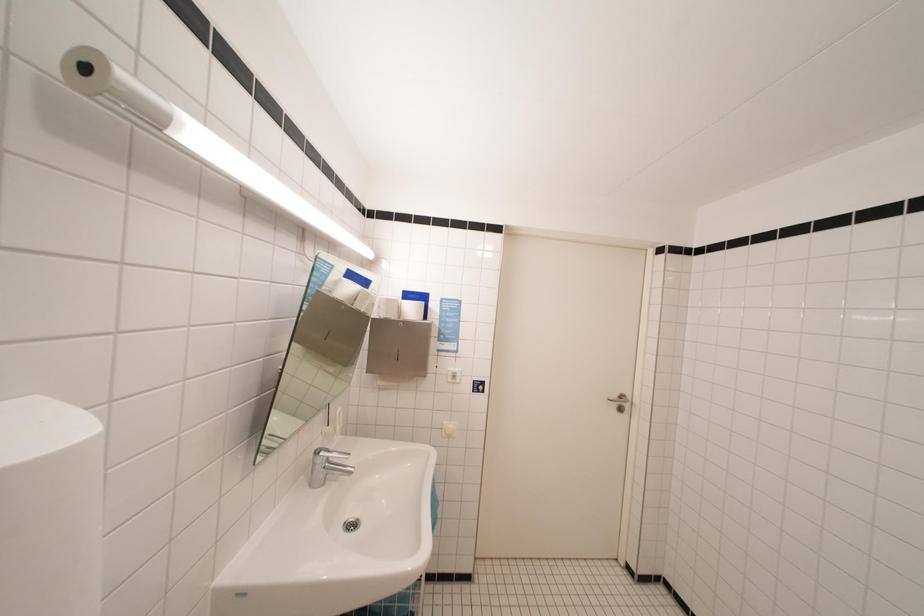
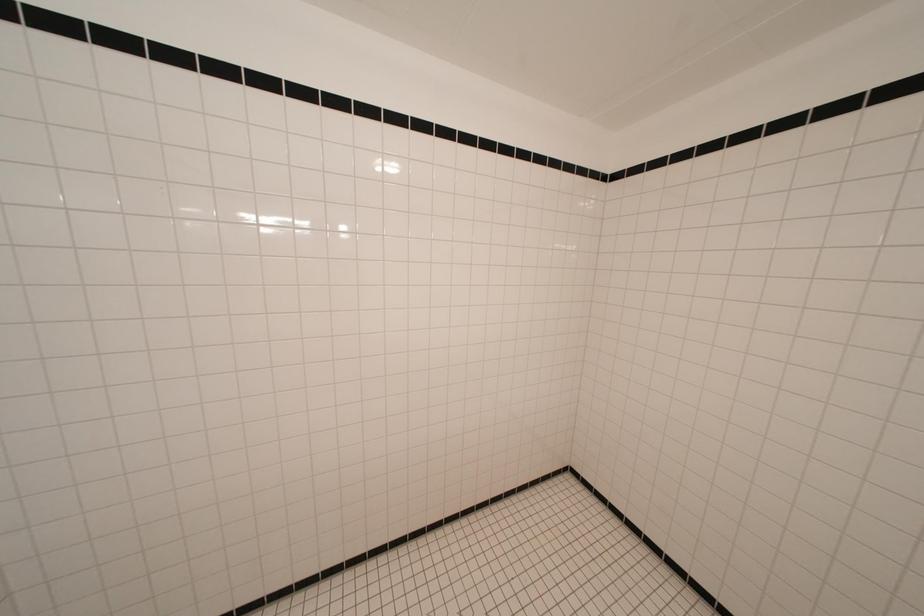
Based on the continuous images, in which direction is the camera rotating?

The camera rotated toward right-down.